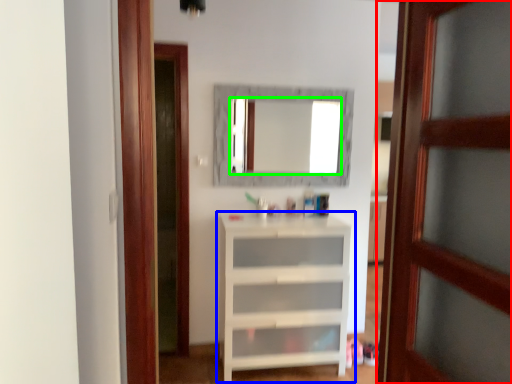
Question: Which is farther away from door (highlighted by a red box)? shelf (highlighted by a blue box) or mirror (highlighted by a green box)?

Choices:
 (A) shelf
 (B) mirror

Answer: (B)